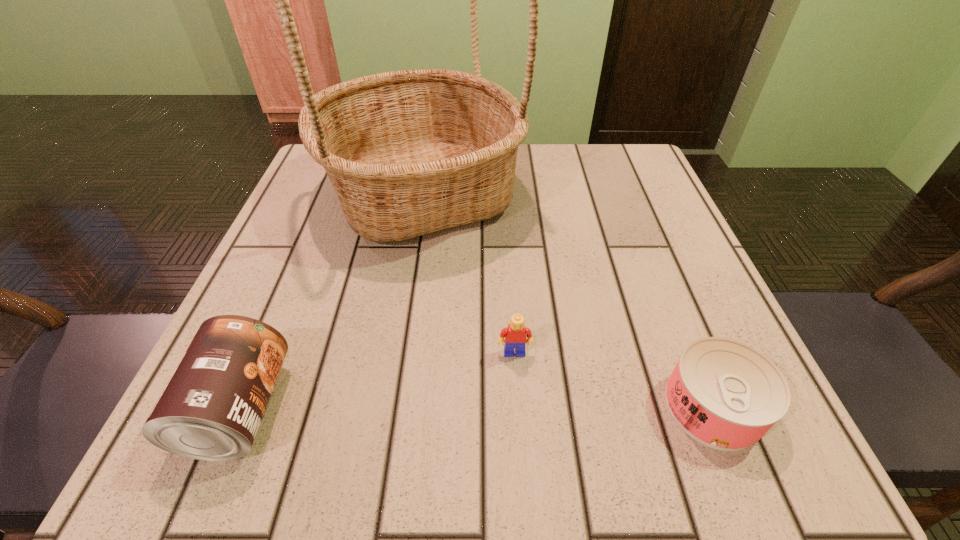
I want to click on vacant space that satisfies the following two spatial constraints: 1. on the front side of the rightmost object; 2. on the front label of the taller can, so click(x=714, y=409).